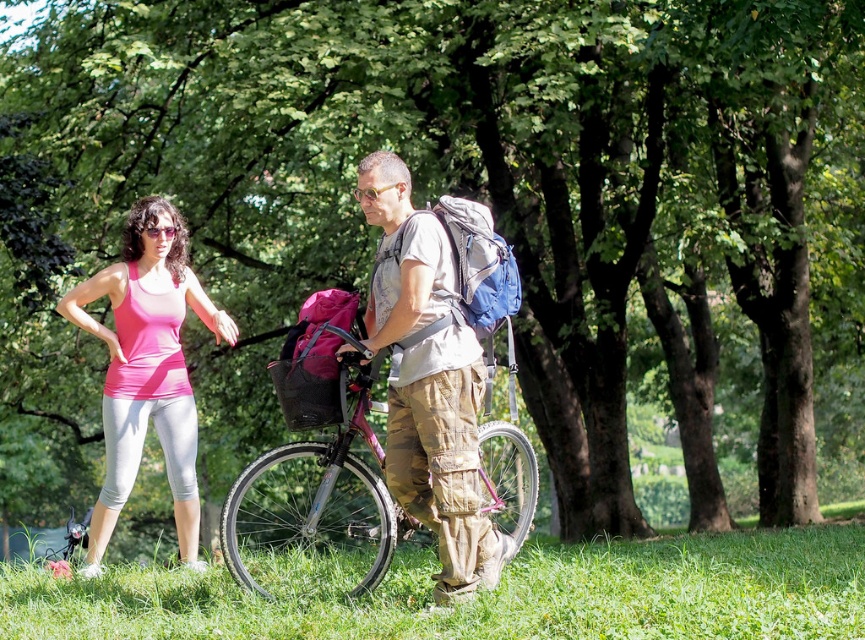
You are a photographer trying to capture a closeup of the pink fabric tank top at left and the camouflage pants at center. Which object should you zoom in on more to ensure both are in focus?

The camouflage pants at center is smaller than the pink fabric tank top at left, so you should zoom in more on the camouflage pants at center to ensure both are in focus.

You are planning to take a short bike ride from the park. You see the pink matte bicycle at center and the pink fabric tank top at left. Which object is closer to the path leading out of the park?

The pink fabric tank top at left is closer to the path leading out of the park because the pink matte bicycle at center is positioned on the right side of it, meaning the tank top is between the bicycle and the path.